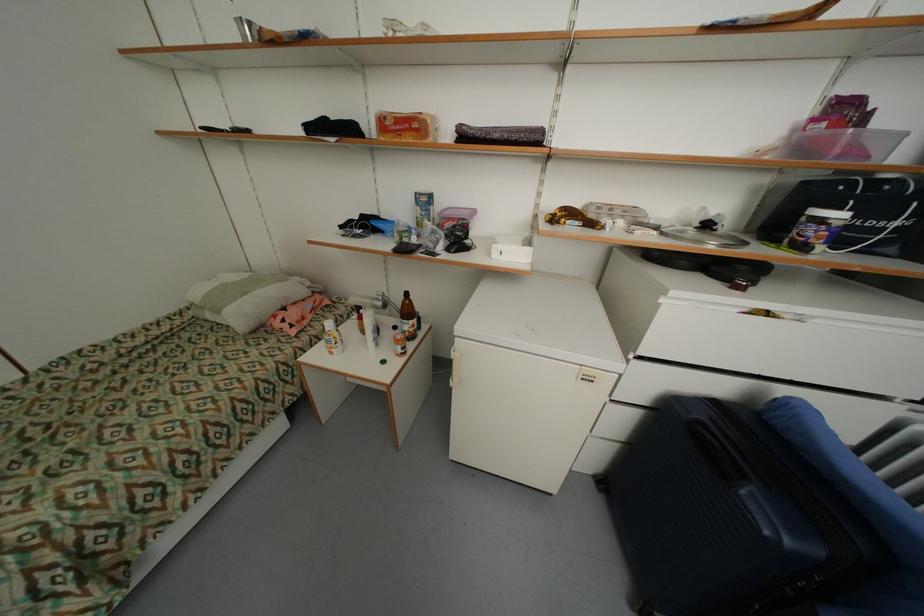
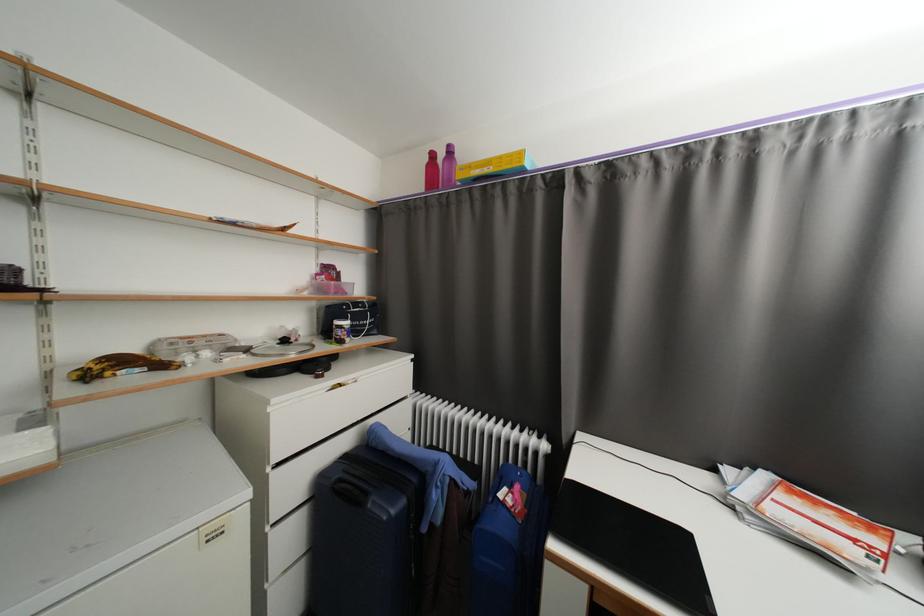
Locate, in the second image, the point that corresponds to [819,233] in the first image.

(346, 334)